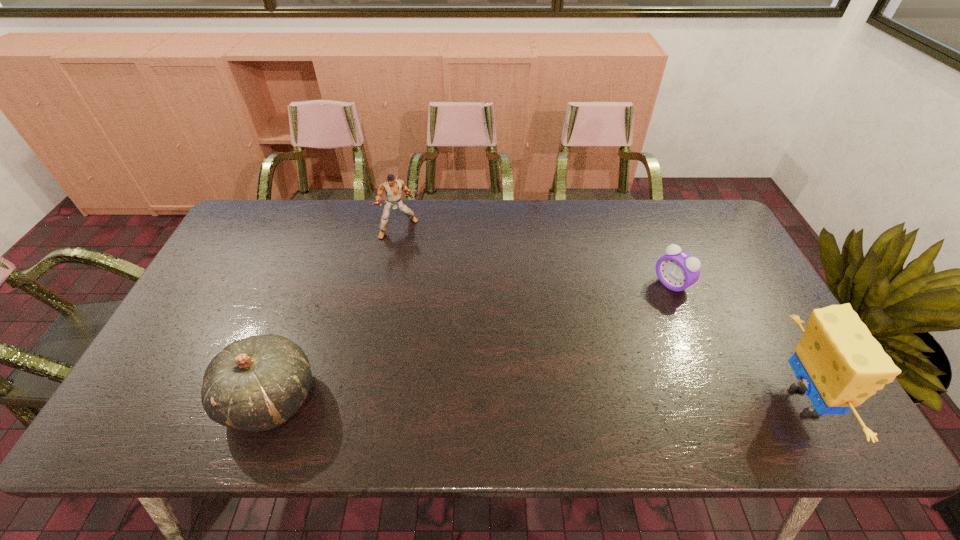
The image size is (960, 540). What are the coordinates of `vacant space that satisfies the following two spatial constraints: 1. on the front side of the rightmost object; 2. on the face of the second shortest object` in the screenshot? It's located at (269, 401).

This screenshot has width=960, height=540. What are the coordinates of `vacant region that satisfies the following two spatial constraints: 1. on the front side of the tallest object; 2. on the face of the third shortest object` in the screenshot? It's located at (364, 401).